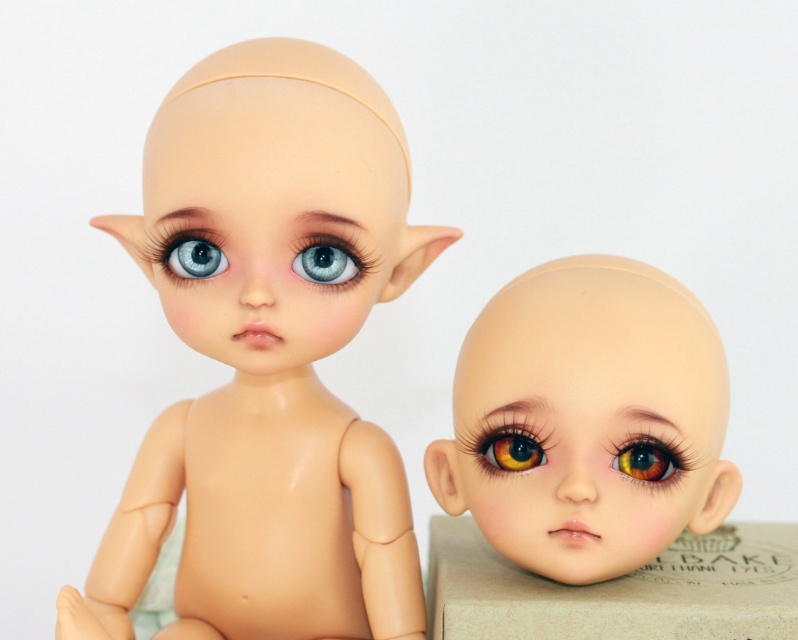
Does matte plastic head at center come behind multicolored glossy eye at center?

No, matte plastic head at center is in front of multicolored glossy eye at center.

Is point (273, 145) more distant than point (637, 452)?

No.

Identify the location of matte plastic head at center. (275, 202).

Can you confirm if matte beige head at center is wider than matte plastic eye at upper left?

Indeed, matte beige head at center has a greater width compared to matte plastic eye at upper left.

Which is above, matte beige head at center or matte plastic eye at upper left?

matte plastic eye at upper left is higher up.

Is point (694, 433) behind point (210, 241)?

No, (694, 433) is in front of (210, 241).

Locate an element on the screen. Image resolution: width=798 pixels, height=640 pixels. matte beige head at center is located at coordinates (587, 419).

Which is more to the left, matte beige head at center or brown glossy eye at center?

brown glossy eye at center is more to the left.

Is matte beige head at center thinner than brown glossy eye at center?

No.

Who is more forward, (583, 476) or (530, 465)?

Point (583, 476) is in front.

The height and width of the screenshot is (640, 798). Identify the location of matte beige head at center. (587, 419).